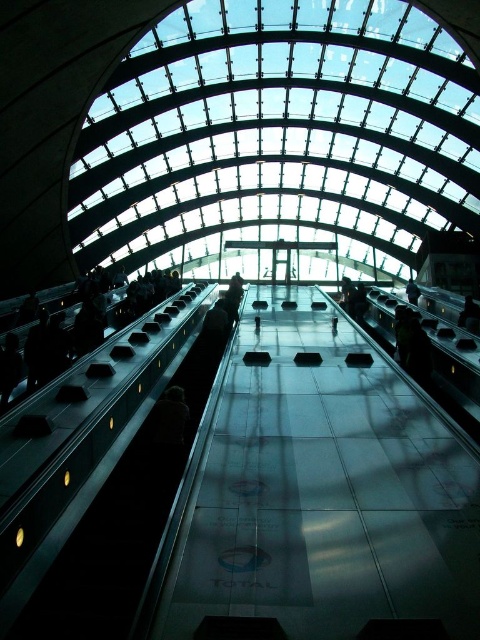
You are standing at the TOTAL walkway and want to take a photo of the metallic escalator at left and the dark gray fabric person at center. Which object should you focus on first if you want to capture both in the same frame without moving your camera?

The metallic escalator at left is much taller than the dark gray fabric person at center, so you should focus on the metallic escalator at left first to ensure both are in frame.